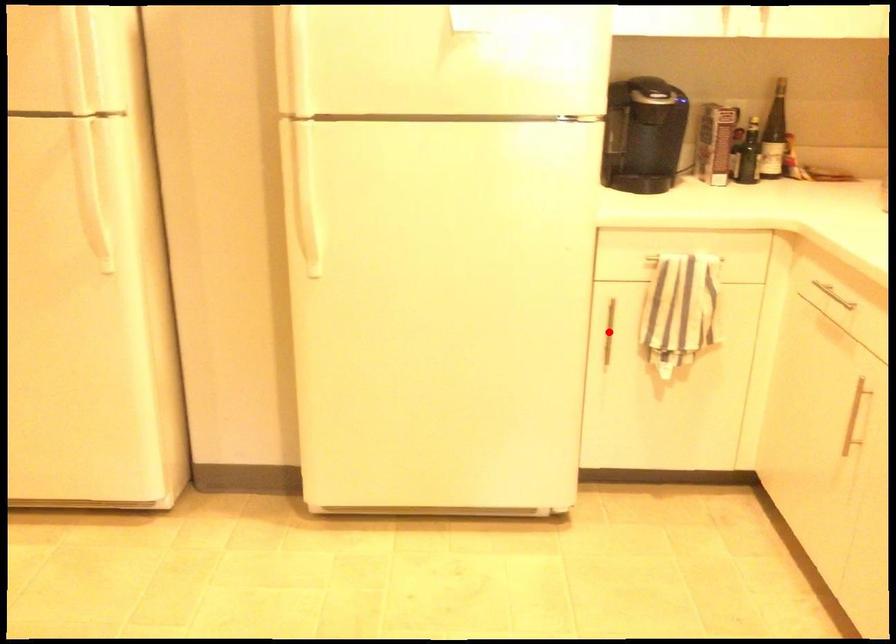
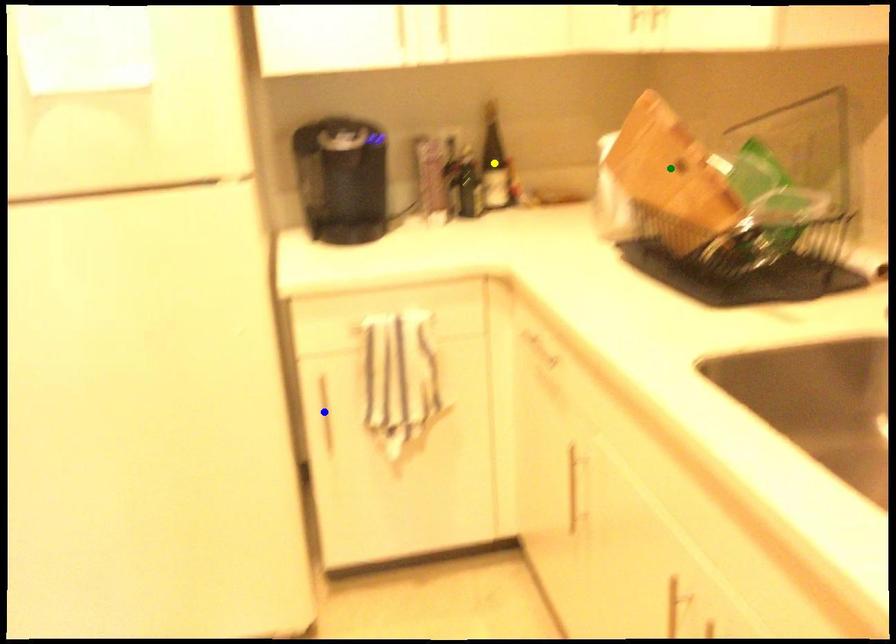
Question: I am providing you with two images of the same scene from different viewpoints. A red point is marked on the first image. You are given multiple points on the second image. In image 2, which mark is for the same physical point as the one in image 1?

Choices:
 (A) green point
 (B) blue point
 (C) yellow point

Answer: (B)